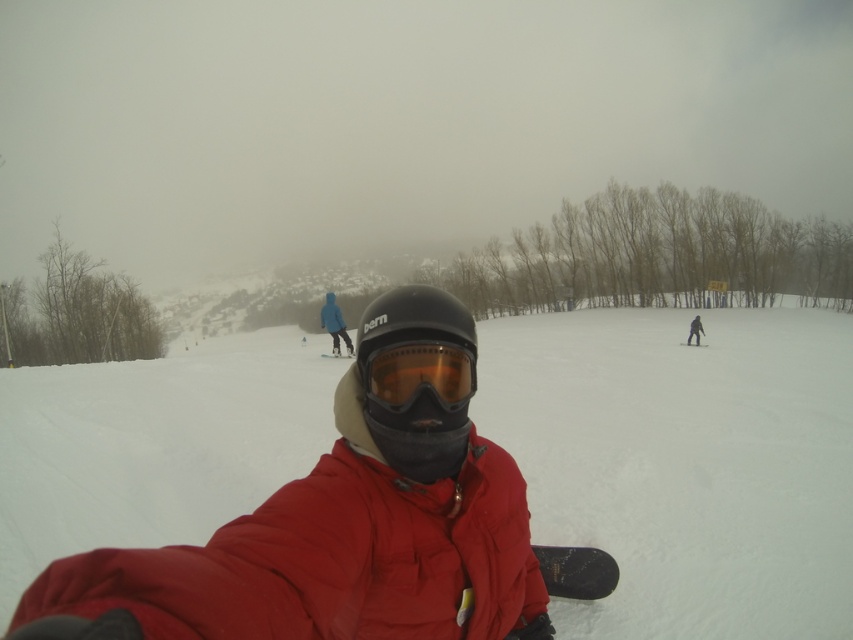
You are a photographer trying to capture the orange tinted plastic goggles at center in the image. What are the coordinates where you should focus your camera?

The orange tinted plastic goggles at center are located at coordinates point [419,374]. So you should focus your camera at point [419,374].

You are navigating a drone through the snowy scene. The drone must fly from the point at coordinates point (413, 369) to the point at coordinates point (566, 554). Will the drone have to go over any obstacles between these two points?

Point (413, 369) is in front of point (566, 554). Since the person with the snowboard is located at point (413, 369), the drone will have to fly over them to reach the destination point (566, 554).

You are a photographer trying to capture a clear photo of the orange tinted plastic goggles at center and the dark gray snowboarder at center. Which object should you zoom in on to ensure it appears larger in your photo?

The orange tinted plastic goggles at center is smaller than the dark gray snowboarder at center, so you should zoom in on the orange tinted plastic goggles at center to make it appear larger in the photo.